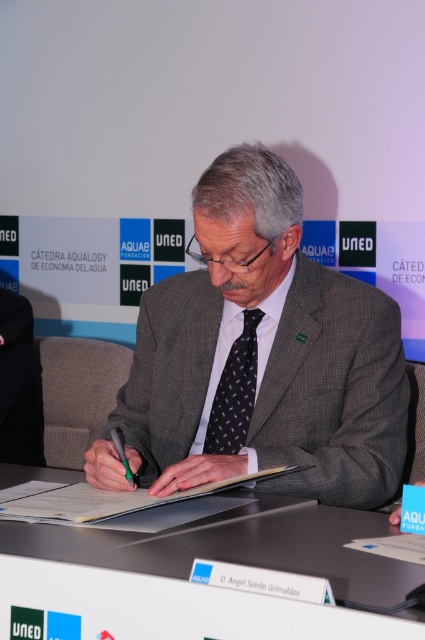
Question: Which of the following is the farthest from the observer?

Choices:
 (A) black plastic pen at center
 (B) black dotted tie at center

Answer: (B)

Question: Is white plastic table at center to the left of black dotted tie at center from the viewer's perspective?

Choices:
 (A) yes
 (B) no

Answer: (A)

Question: Considering the real-world distances, which object is farthest from the black plastic pen at center?

Choices:
 (A) white plastic table at center
 (B) gray wool suit at center

Answer: (B)

Question: Is black dotted tie at center above black plastic pen at center?

Choices:
 (A) yes
 (B) no

Answer: (A)

Question: Does gray wool suit at center have a greater width compared to black dotted tie at center?

Choices:
 (A) yes
 (B) no

Answer: (A)

Question: Estimate the real-world distances between objects in this image. Which object is farther from the white plastic table at center?

Choices:
 (A) black dotted tie at center
 (B) black plastic pen at center

Answer: (A)